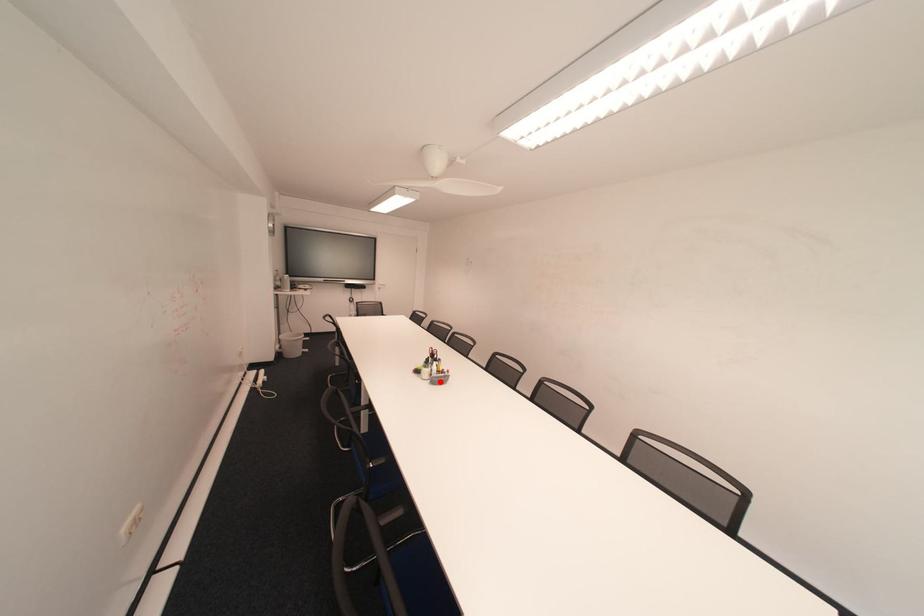
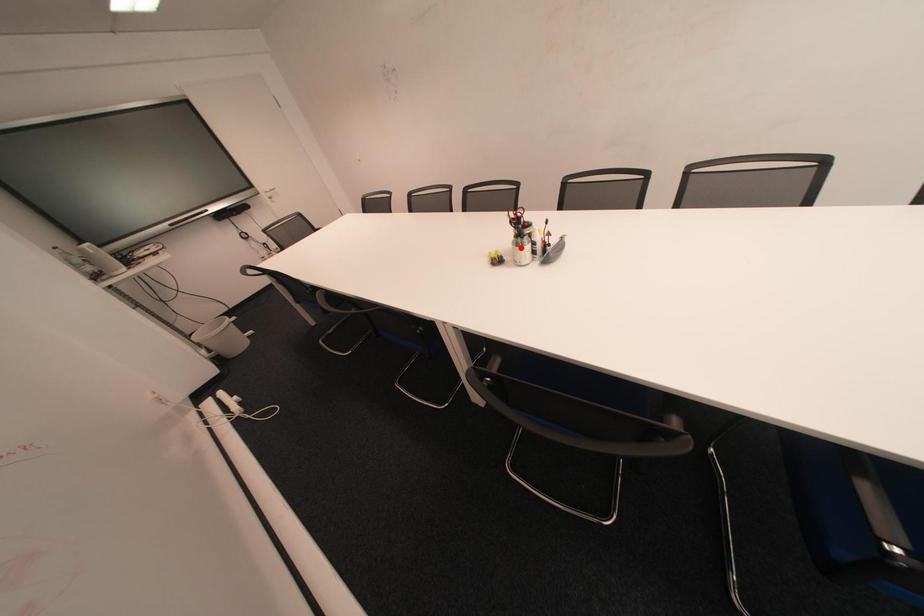
I am providing you with two images of the same scene from different viewpoints. A red point is marked on the first image and another point is marked on the second image. Do the highlighted points in image1 and image2 indicate the same real-world spot?

No